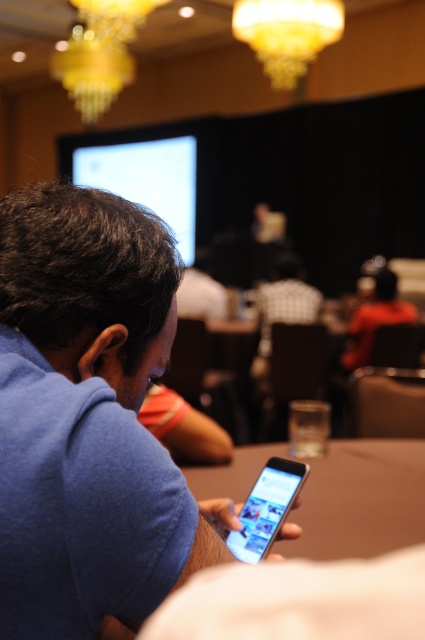
You are organizing a presentation in the conference room and need to place both the brown wooden table at center and the silver metallic smartphone at center on a shelf. The shelf has a height limit of 1 meter. Which object might not fit on the shelf based on their heights?

The silver metallic smartphone at center might not fit on the shelf because the brown wooden table at center is shorter than it, and if the smartphone exceeds the 1 meter height limit, it would not fit.

You are sitting at the brown wooden table at center and want to hand a document to the person wearing the orange shirt at center. Can you reach them directly without moving from your seat?

The brown wooden table at center is in front of orange shirt at center, so you can reach them directly without needing to move from your seat.